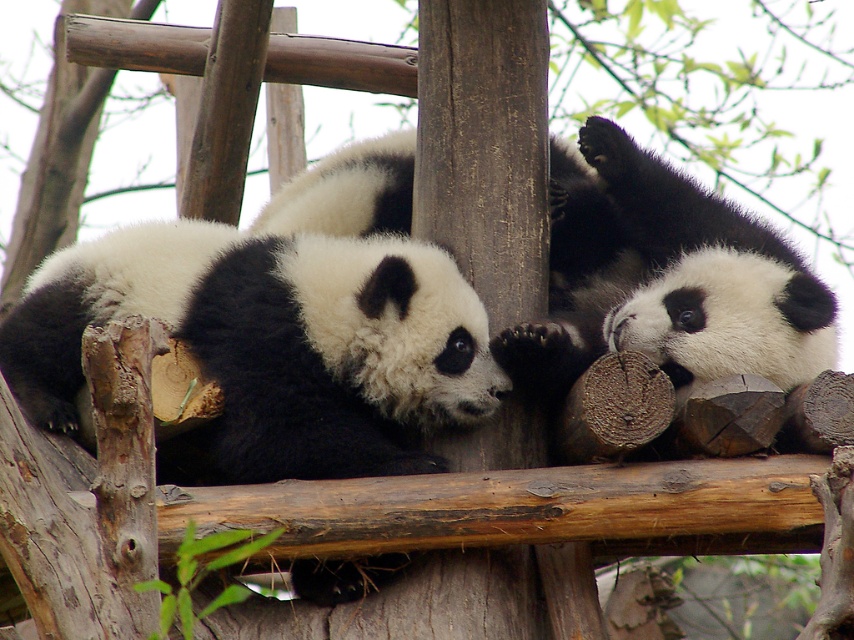
Based on the photo, who is taller, black and white fur panda at center or black fuzzy panda at center?

black fuzzy panda at center

Can you confirm if black and white fur panda at center is positioned above black fuzzy panda at center?

Actually, black and white fur panda at center is below black fuzzy panda at center.

Who is more distant from viewer, (303, 474) or (762, 244)?

The point (762, 244) is more distant.

Find the location of a particular element. Image resolution: width=854 pixels, height=640 pixels. black and white fur panda at center is located at coordinates (273, 342).